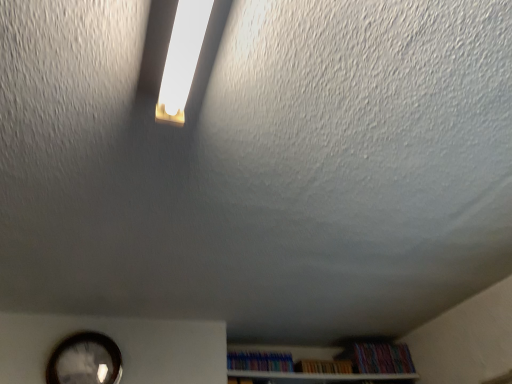
Question: Is multicolored plastic books at lower center, arranged as the third book when viewed from the right, aimed at white wooden shelf at lower center?

Choices:
 (A) no
 (B) yes

Answer: (A)

Question: Does multicolored plastic books at lower center, the 1th book from the left, appear on the right side of white wooden shelf at lower center?

Choices:
 (A) no
 (B) yes

Answer: (A)

Question: From the image's perspective, is multicolored plastic books at lower center, arranged as the third book when viewed from the right, under white wooden shelf at lower center?

Choices:
 (A) no
 (B) yes

Answer: (A)

Question: Is white wooden shelf at lower center surrounded by multicolored plastic books at lower center, arranged as the third book when viewed from the right?

Choices:
 (A) no
 (B) yes

Answer: (A)

Question: Does multicolored plastic books at lower center, the 1th book from the left, have a greater height compared to white wooden shelf at lower center?

Choices:
 (A) yes
 (B) no

Answer: (A)

Question: Which is correct: wooden bookshelf at lower center, marked as the second book in a left-to-right arrangement, is inside matte black clock at lower left, or outside of it?

Choices:
 (A) inside
 (B) outside

Answer: (B)

Question: From the image's perspective, is wooden bookshelf at lower center, marked as the second book in a left-to-right arrangement, located above or below matte black clock at lower left?

Choices:
 (A) above
 (B) below

Answer: (B)

Question: Is wooden bookshelf at lower center, marked as the second book in a left-to-right arrangement, bigger or smaller than matte black clock at lower left?

Choices:
 (A) big
 (B) small

Answer: (B)

Question: Considering the positions of wooden bookshelf at lower center, marked as the 2th book in a right-to-left arrangement, and matte black clock at lower left in the image, is wooden bookshelf at lower center, marked as the 2th book in a right-to-left arrangement, wider or thinner than matte black clock at lower left?

Choices:
 (A) thin
 (B) wide

Answer: (B)

Question: Is wooden bookshelf at lower center, marked as the 2th book in a right-to-left arrangement, situated inside white wooden shelf at lower center or outside?

Choices:
 (A) inside
 (B) outside

Answer: (B)

Question: From a real-world perspective, is wooden bookshelf at lower center, marked as the second book in a left-to-right arrangement, positioned above or below white wooden shelf at lower center?

Choices:
 (A) above
 (B) below

Answer: (A)

Question: Considering the positions of wooden bookshelf at lower center, marked as the second book in a left-to-right arrangement, and white wooden shelf at lower center in the image, is wooden bookshelf at lower center, marked as the second book in a left-to-right arrangement, taller or shorter than white wooden shelf at lower center?

Choices:
 (A) short
 (B) tall

Answer: (B)

Question: From the image's perspective, is wooden bookshelf at lower center, marked as the second book in a left-to-right arrangement, positioned above or below white wooden shelf at lower center?

Choices:
 (A) above
 (B) below

Answer: (A)

Question: Do you think multicolored paperbacks at lower right, positioned as the 1th book in right-to-left order, is within white wooden shelf at lower center, or outside of it?

Choices:
 (A) inside
 (B) outside

Answer: (B)

Question: Is multicolored paperbacks at lower right, which appears as the 3th book when viewed from the left, in front of or behind white wooden shelf at lower center in the image?

Choices:
 (A) behind
 (B) front

Answer: (A)